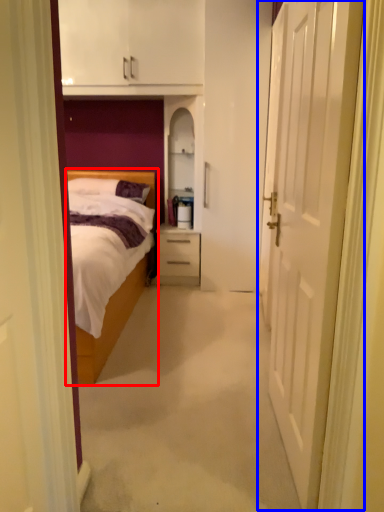
Question: Which object is closer to the camera taking this photo, bed (highlighted by a red box) or door (highlighted by a blue box)?

Choices:
 (A) bed
 (B) door

Answer: (B)